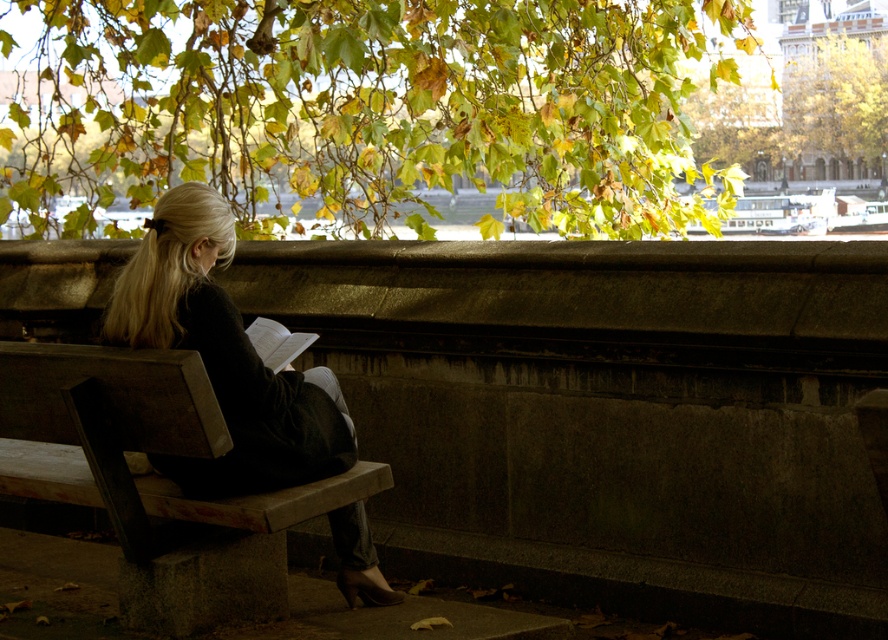
Is green leafy branches at upper center behind black fabric jacket at left?

Yes, green leafy branches at upper center is further from the viewer.

Looking at this image, does green leafy branches at upper center have a greater height compared to black fabric jacket at left?

No, green leafy branches at upper center is not taller than black fabric jacket at left.

This screenshot has width=888, height=640. Describe the element at coordinates (366, 109) in the screenshot. I see `green leafy branches at upper center` at that location.

Where is `green leafy branches at upper center`? green leafy branches at upper center is located at coordinates (366, 109).

Can you confirm if green leafy branches at upper center is bigger than green leafy tree at upper center?

Actually, green leafy branches at upper center might be smaller than green leafy tree at upper center.

Which is behind, point (306, 132) or point (869, 97)?

The point (869, 97) is behind.

Identify the location of green leafy branches at upper center. (366, 109).

Find the location of a particular element. green leafy branches at upper center is located at coordinates (366, 109).

How distant is wooden bench at center from black fabric jacket at left?

They are 37.55 centimeters apart.

Is wooden bench at center positioned in front of black fabric jacket at left?

Yes, wooden bench at center is closer to the viewer.

Is point (123, 488) positioned after point (230, 371)?

Yes, it is.

In order to click on wooden bench at center in this screenshot , I will do `click(153, 477)`.